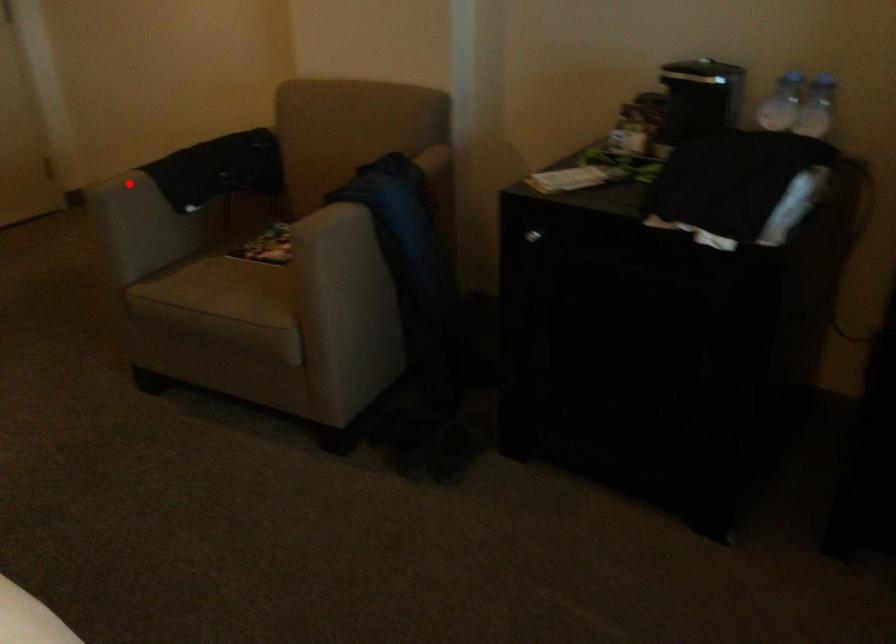
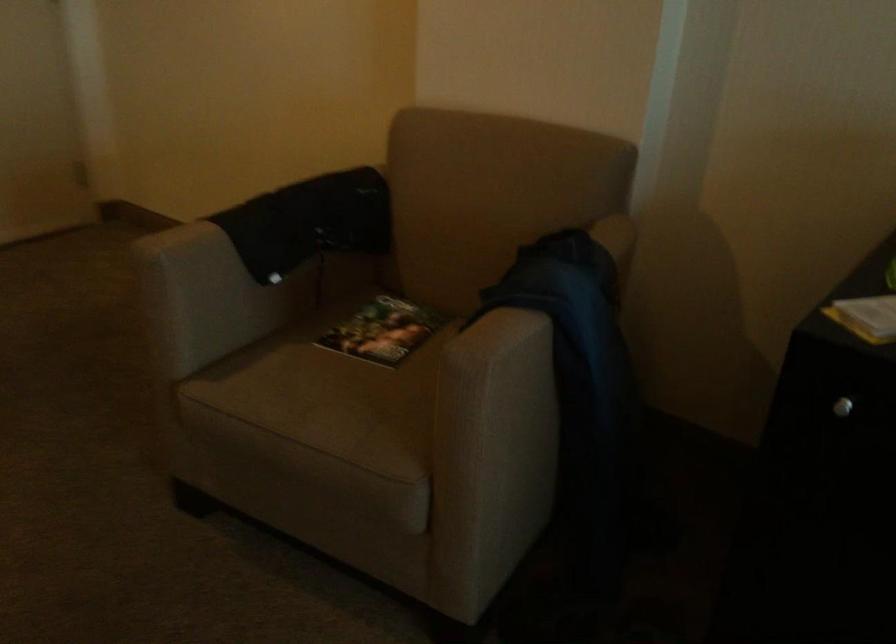
Locate, in the second image, the point that corresponds to the highlighted location in the first image.

(201, 243)